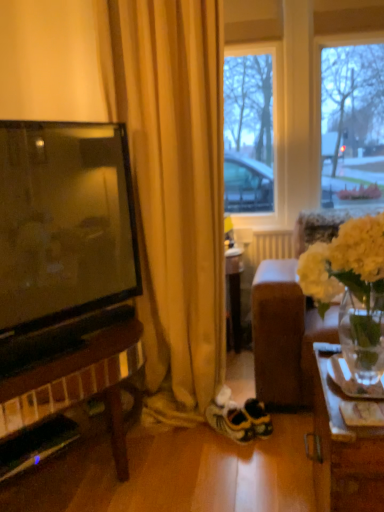
The width and height of the screenshot is (384, 512). What are the coordinates of `white suede sneakers at center` in the screenshot? It's located at (229, 417).

At what (x,y) coordinates should I click in order to perform the action: click on white matte radiator at center. Please return your answer as a coordinate pair (x, y). Looking at the image, I should click on (265, 244).

What do you see at coordinates (175, 192) in the screenshot? I see `yellow fabric curtain at left` at bounding box center [175, 192].

What do you see at coordinates (345, 263) in the screenshot? This screenshot has width=384, height=512. I see `white matte vase at right` at bounding box center [345, 263].

This screenshot has width=384, height=512. What are the coordinates of `white fabric couch at right` in the screenshot? It's located at (286, 336).

Is white suede sneakers at center located within white matte vase at right?

Definitely not — white suede sneakers at center is not inside white matte vase at right.

Identify the location of flower that is on the right side of white suede sneakers at center. This screenshot has width=384, height=512. (345, 263).

Which object is thinner, white matte vase at right or white suede sneakers at center?

Thinner between the two is white suede sneakers at center.

From their relative heights in the image, would you say white matte vase at right is taller or shorter than yellow fabric curtain at left?

white matte vase at right is shorter than yellow fabric curtain at left.

Where is `flower on the right side of yellow fabric curtain at left`? Image resolution: width=384 pixels, height=512 pixels. flower on the right side of yellow fabric curtain at left is located at coordinates (345, 263).

Is white matte vase at right wider or thinner than yellow fabric curtain at left?

In the image, white matte vase at right appears to be wider than yellow fabric curtain at left.

Considering the relative sizes of white painted wood window frame at upper center and white suede sneakers at center in the image provided, is white painted wood window frame at upper center shorter than white suede sneakers at center?

In fact, white painted wood window frame at upper center may be taller than white suede sneakers at center.

Considering their positions, is white painted wood window frame at upper center located in front of or behind white suede sneakers at center?

In the image, white painted wood window frame at upper center appears behind white suede sneakers at center.

Considering the sizes of objects white painted wood window frame at upper center and white suede sneakers at center in the image provided, who is bigger, white painted wood window frame at upper center or white suede sneakers at center?

With larger size is white painted wood window frame at upper center.

Does white painted wood window frame at upper center appear on the right side of white suede sneakers at center?

Correct, you'll find white painted wood window frame at upper center to the right of white suede sneakers at center.

Based on their positions, is yellow fabric curtain at left located to the left or right of white matte vase at right?

yellow fabric curtain at left is to the left of white matte vase at right.

How different are the orientations of yellow fabric curtain at left and white matte vase at right in degrees?

The angular difference between yellow fabric curtain at left and white matte vase at right is 0.0325 degrees.

From a real-world perspective, is yellow fabric curtain at left positioned above or below white matte vase at right?

In terms of real-world spatial position, yellow fabric curtain at left is above white matte vase at right.

Based on their sizes in the image, would you say yellow fabric curtain at left is bigger or smaller than white matte vase at right?

In the image, yellow fabric curtain at left appears to be larger than white matte vase at right.

Would you consider white fabric couch at right to be distant from white matte radiator at center?

That's not correct — white fabric couch at right is a little close to white matte radiator at center.

Is white fabric couch at right to the left or to the right of white matte radiator at center in the image?

Based on their positions, white fabric couch at right is located to the left of white matte radiator at center.

The image size is (384, 512). What are the coordinates of `radiator behind the white fabric couch at right` in the screenshot? It's located at (265, 244).

Does point (320, 318) lie behind point (243, 244)?

No, it is in front of (243, 244).

Is point (241, 411) in front of point (262, 247)?

Yes.

Does white suede sneakers at center turn towards white matte radiator at center?

No, white suede sneakers at center does not turn towards white matte radiator at center.

Considering the sizes of white suede sneakers at center and white matte radiator at center in the image, is white suede sneakers at center bigger or smaller than white matte radiator at center?

white suede sneakers at center is smaller than white matte radiator at center.

From the image's perspective, is white suede sneakers at center on top of white matte radiator at center?

No, from the image's perspective, white suede sneakers at center is not above white matte radiator at center.

From a real-world perspective, is white fabric couch at right physically above white suede sneakers at center?

Indeed, from a real-world perspective, white fabric couch at right stands above white suede sneakers at center.

Consider the image. Are white fabric couch at right and white suede sneakers at center making contact?

No, white fabric couch at right is not next to white suede sneakers at center.

Would you say white fabric couch at right is inside or outside white suede sneakers at center?

white fabric couch at right is not inside white suede sneakers at center, it's outside.

Which object is further away from the camera taking this photo, white fabric couch at right or white suede sneakers at center?

white suede sneakers at center.

The width and height of the screenshot is (384, 512). In order to click on flower lying on the right of white suede sneakers at center in this screenshot , I will do `click(345, 263)`.

Identify the location of curtain above the white matte vase at right (from the image's perspective). The width and height of the screenshot is (384, 512). pyautogui.click(x=175, y=192).

Based on their spatial positions, is white fabric couch at right or white suede sneakers at center closer to yellow fabric curtain at left?

white fabric couch at right lies closer to yellow fabric curtain at left than the other object.

Considering their positions, is white suede sneakers at center positioned further to white matte radiator at center than white painted wood window frame at upper center?

white suede sneakers at center lies further to white matte radiator at center than the other object.

Estimate the real-world distances between objects in this image. Which object is further from white matte radiator at center, white suede sneakers at center or yellow fabric curtain at left?

white suede sneakers at center.

Estimate the real-world distances between objects in this image. Which object is further from white matte radiator at center, yellow fabric curtain at left or white suede sneakers at center?

The object further to white matte radiator at center is white suede sneakers at center.

From the image, which object appears to be farther from white matte radiator at center, white painted wood window frame at upper center or yellow fabric curtain at left?

yellow fabric curtain at left is positioned further to the anchor white matte radiator at center.

Which object lies further to the anchor point white suede sneakers at center, white matte radiator at center or yellow fabric curtain at left?

The object further to white suede sneakers at center is white matte radiator at center.

Consider the image. Estimate the real-world distances between objects in this image. Which object is closer to white suede sneakers at center, white matte radiator at center or white fabric couch at right?

The object closer to white suede sneakers at center is white fabric couch at right.

Based on their spatial positions, is yellow fabric curtain at left or white matte radiator at center further from white matte vase at right?

white matte radiator at center is further to white matte vase at right.

You are a GUI agent. You are given a task and a screenshot of the screen. Output one action in this format:
    pyautogui.click(x=<x>, y=<y>)
    Task: Click on the curtain between white fabric couch at right and white painted wood window frame at upper center in the front-back direction
    The image size is (384, 512).
    Given the screenshot: What is the action you would take?
    pyautogui.click(x=175, y=192)

Locate an element on the screen. studio couch between white painted wood window frame at upper center and white suede sneakers at center vertically is located at coordinates (286, 336).

Image resolution: width=384 pixels, height=512 pixels. I want to click on sneakers positioned between yellow fabric curtain at left and white matte radiator at center from near to far, so click(x=229, y=417).

Identify the location of curtain between white painted wood window frame at upper center and white suede sneakers at center in the up-down direction. The image size is (384, 512). (175, 192).